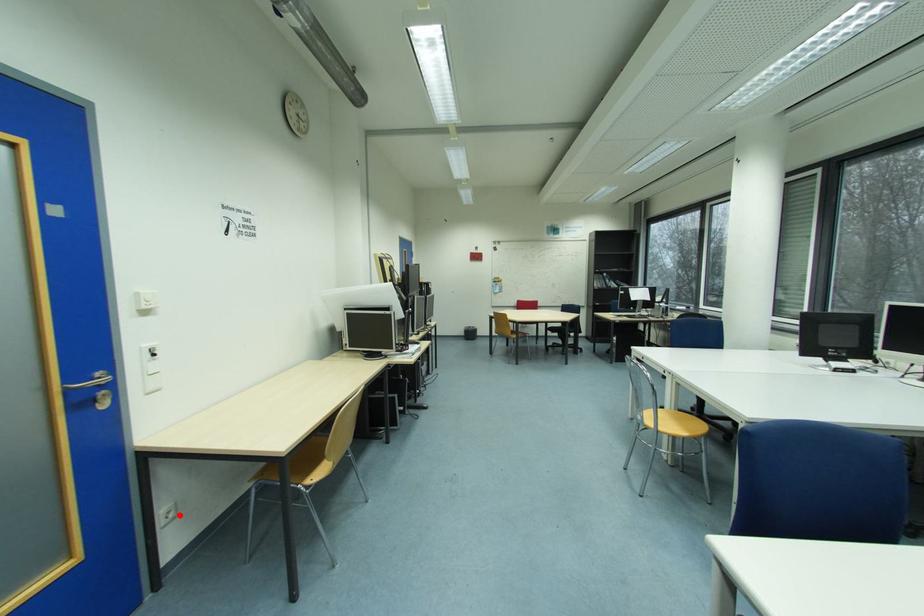
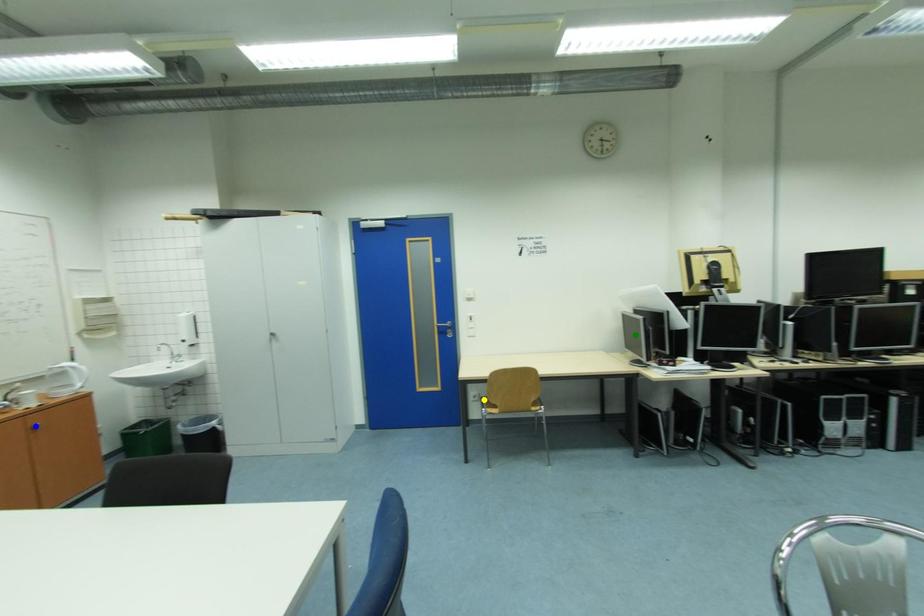
Question: I am providing you with two images of the same scene from different viewpoints. A red point is marked on the first image. You are given multiple points on the second image. Which point in image 2 represents the same 3d spot as the red point in image 1?

Choices:
 (A) blue point
 (B) yellow point
 (C) green point

Answer: (B)